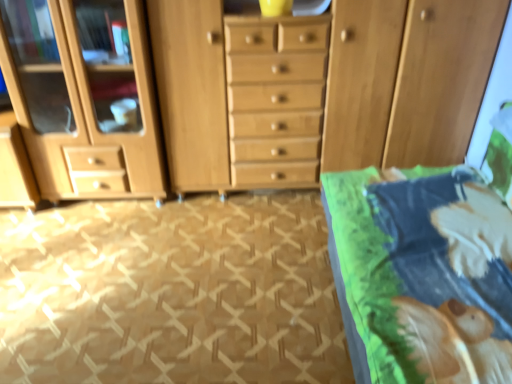
Question: Choose the correct answer: Is wooden dresser at center inside green fabric bed at right or outside it?

Choices:
 (A) outside
 (B) inside

Answer: (A)

Question: Is point (321, 34) positioned closer to the camera than point (507, 264)?

Choices:
 (A) farther
 (B) closer

Answer: (A)

Question: Which of these objects is positioned farthest from the wooden dresser at center?

Choices:
 (A) beige carpet at lower left
 (B) green fabric bed at right

Answer: (B)

Question: Which of these objects is positioned farthest from the beige carpet at lower left?

Choices:
 (A) wooden dresser at center
 (B) green fabric bed at right

Answer: (A)